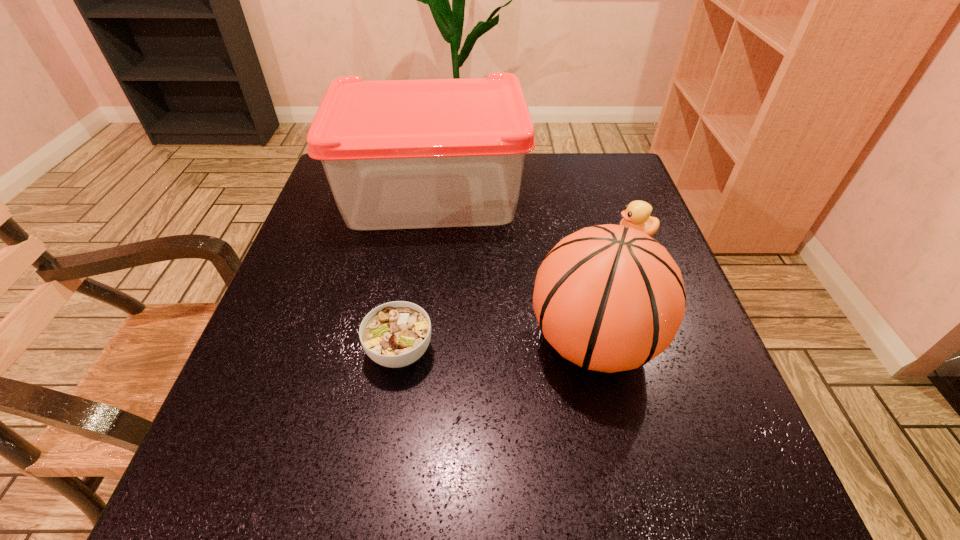
Image resolution: width=960 pixels, height=540 pixels. In order to click on tray in this screenshot , I will do `click(398, 154)`.

Locate an element on the screen. This screenshot has width=960, height=540. basketball is located at coordinates (609, 298).

Identify the location of the third tallest object. (636, 215).

What are the coordinates of `the shortest object` in the screenshot? It's located at (395, 334).

The image size is (960, 540). What are the coordinates of `vacant position located 0.050m on the left of the tray` in the screenshot? It's located at (319, 194).

Locate an element on the screen. The height and width of the screenshot is (540, 960). blank area located 0.050m on the right of the basketball is located at coordinates [687, 342].

This screenshot has height=540, width=960. Find the location of `vacant space located on the face of the duckling`. vacant space located on the face of the duckling is located at coordinates (567, 234).

Locate an element on the screen. vacant space located 0.260m on the face of the duckling is located at coordinates (501, 234).

Find the location of a particular element. free spot located 0.240m on the face of the duckling is located at coordinates (510, 234).

In order to click on vacant region located on the right of the shortest object in this screenshot , I will do `click(582, 351)`.